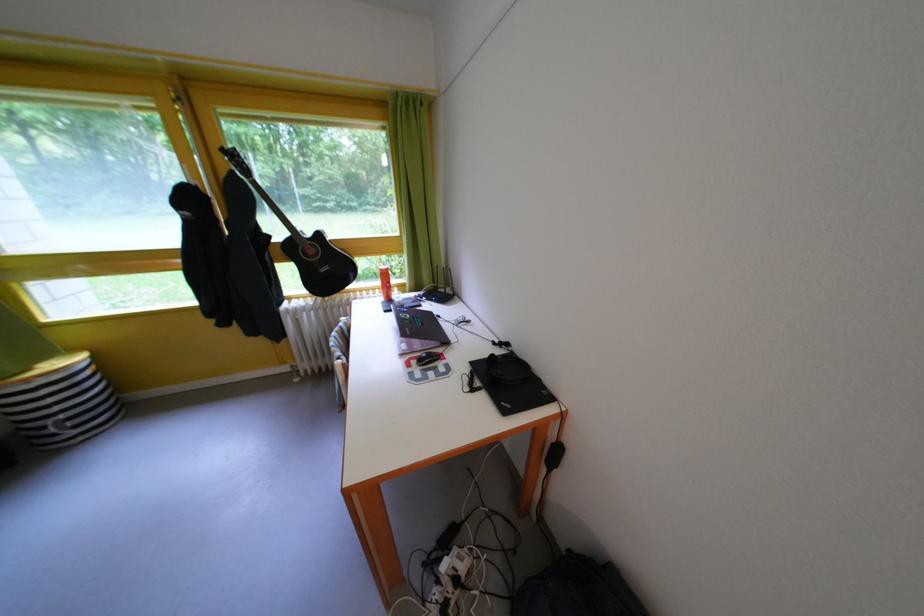
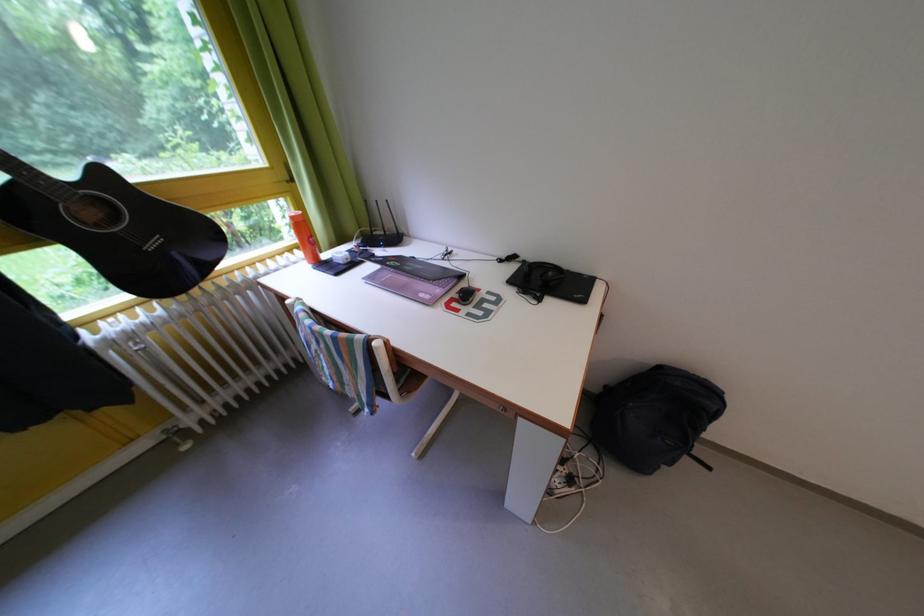
Locate, in the second image, the point that corresponds to point (306, 317) in the first image.

(140, 342)